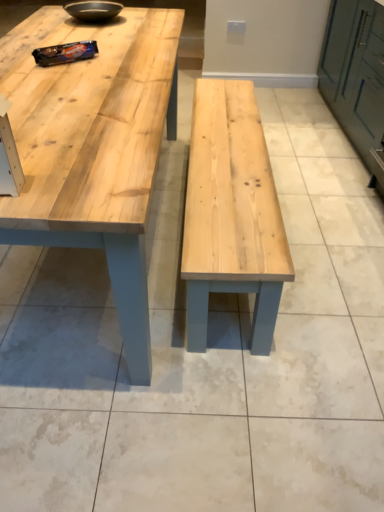
This screenshot has width=384, height=512. In order to click on vacant space that is to the left of matte black bowl at upper center in this screenshot , I will do `click(42, 22)`.